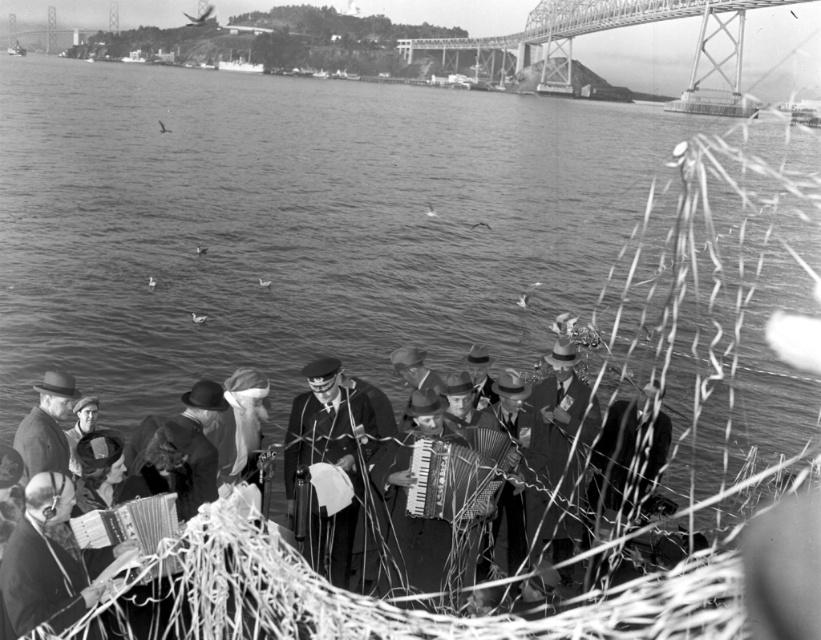
Does point (723, 113) lie behind point (108, 513)?

That is True.

How far apart are metallic steel bridge at upper center and metallic silver accordion at lower left?

metallic steel bridge at upper center is 225.14 meters from metallic silver accordion at lower left.

This screenshot has height=640, width=821. What do you see at coordinates (618, 28) in the screenshot?
I see `metallic steel bridge at upper center` at bounding box center [618, 28].

Where is `metallic steel bridge at upper center`? metallic steel bridge at upper center is located at coordinates (618, 28).

Is point (542, 522) positioned in front of point (170, 500)?

No, it is not.

The image size is (821, 640). Identify the location of smooth leather hat at center. (558, 452).

Between metallic accordion at center and metallic silver accordion at lower left, which one is positioned higher?

metallic accordion at center

Who is more distant from viewer, (476, 477) or (99, 518)?

The point (476, 477) is behind.

Is point (452, 502) positioned before point (175, 566)?

No.

Where is `metallic accordion at center`? The width and height of the screenshot is (821, 640). metallic accordion at center is located at coordinates (457, 474).